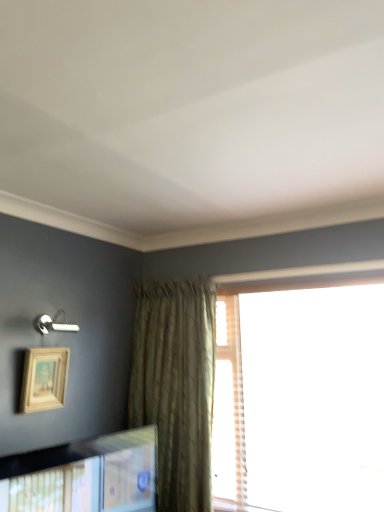
Question: Considering the relative sizes of translucent plaid curtain at right and wooden picture frame at upper left, positioned as the first picture frame in top-to-bottom order, in the image provided, is translucent plaid curtain at right wider than wooden picture frame at upper left, positioned as the first picture frame in top-to-bottom order,?

Choices:
 (A) no
 (B) yes

Answer: (A)

Question: From the image's perspective, is translucent plaid curtain at right located beneath wooden picture frame at upper left, which is the 2th picture frame in bottom-to-top order?

Choices:
 (A) yes
 (B) no

Answer: (A)

Question: Is wooden picture frame at upper left, positioned as the first picture frame in top-to-bottom order, at the back of translucent plaid curtain at right?

Choices:
 (A) no
 (B) yes

Answer: (A)

Question: Is translucent plaid curtain at right directly adjacent to wooden picture frame at upper left, positioned as the first picture frame in top-to-bottom order?

Choices:
 (A) no
 (B) yes

Answer: (A)

Question: Is translucent plaid curtain at right positioned behind wooden picture frame at upper left, positioned as the first picture frame in top-to-bottom order?

Choices:
 (A) no
 (B) yes

Answer: (B)

Question: From the image's perspective, is translucent plaid curtain at right located above or below wooden picture frame at lower left, which appears as the second picture frame when viewed from the top?

Choices:
 (A) above
 (B) below

Answer: (A)

Question: Considering the positions of translucent plaid curtain at right and wooden picture frame at lower left, the first picture frame when ordered from bottom to top, in the image, is translucent plaid curtain at right wider or thinner than wooden picture frame at lower left, the first picture frame when ordered from bottom to top,?

Choices:
 (A) wide
 (B) thin

Answer: (B)

Question: Considering their positions, is translucent plaid curtain at right located in front of or behind wooden picture frame at lower left, which appears as the second picture frame when viewed from the top?

Choices:
 (A) behind
 (B) front

Answer: (A)

Question: In terms of height, does translucent plaid curtain at right look taller or shorter compared to wooden picture frame at lower left, the first picture frame when ordered from bottom to top?

Choices:
 (A) short
 (B) tall

Answer: (B)

Question: Does point (104, 445) appear closer or farther from the camera than point (44, 351)?

Choices:
 (A) farther
 (B) closer

Answer: (B)

Question: From the image's perspective, is wooden picture frame at lower left, the first picture frame when ordered from bottom to top, positioned above or below wooden picture frame at upper left, which is the 2th picture frame in bottom-to-top order?

Choices:
 (A) above
 (B) below

Answer: (B)

Question: In terms of size, does wooden picture frame at lower left, the first picture frame when ordered from bottom to top, appear bigger or smaller than wooden picture frame at upper left, positioned as the first picture frame in top-to-bottom order?

Choices:
 (A) big
 (B) small

Answer: (A)

Question: Visually, is wooden picture frame at lower left, the first picture frame when ordered from bottom to top, positioned to the left or to the right of wooden picture frame at upper left, positioned as the first picture frame in top-to-bottom order?

Choices:
 (A) left
 (B) right

Answer: (B)

Question: In terms of size, does wooden picture frame at upper left, which is the 2th picture frame in bottom-to-top order, appear bigger or smaller than translucent plaid curtain at right?

Choices:
 (A) small
 (B) big

Answer: (A)

Question: From a real-world perspective, is wooden picture frame at upper left, which is the 2th picture frame in bottom-to-top order, positioned above or below translucent plaid curtain at right?

Choices:
 (A) above
 (B) below

Answer: (A)